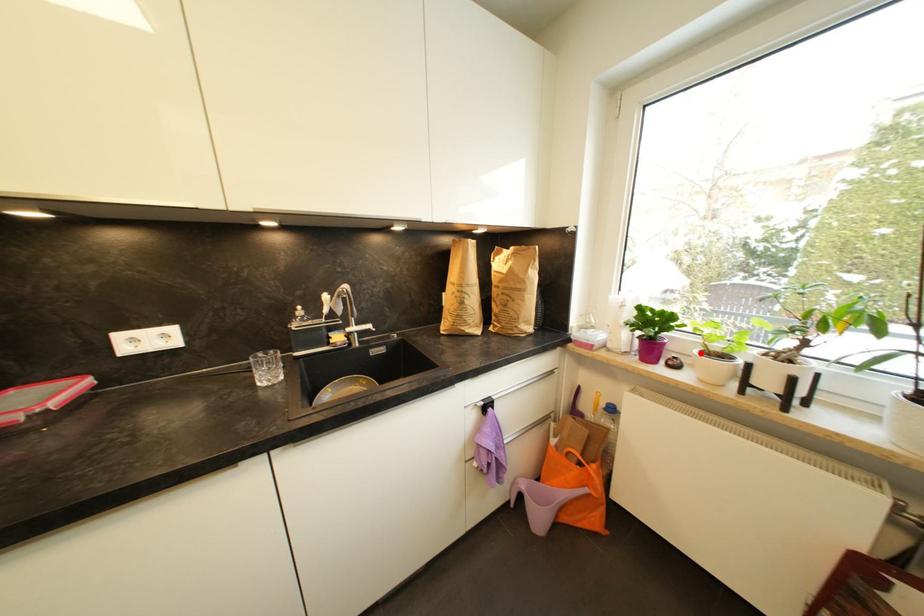
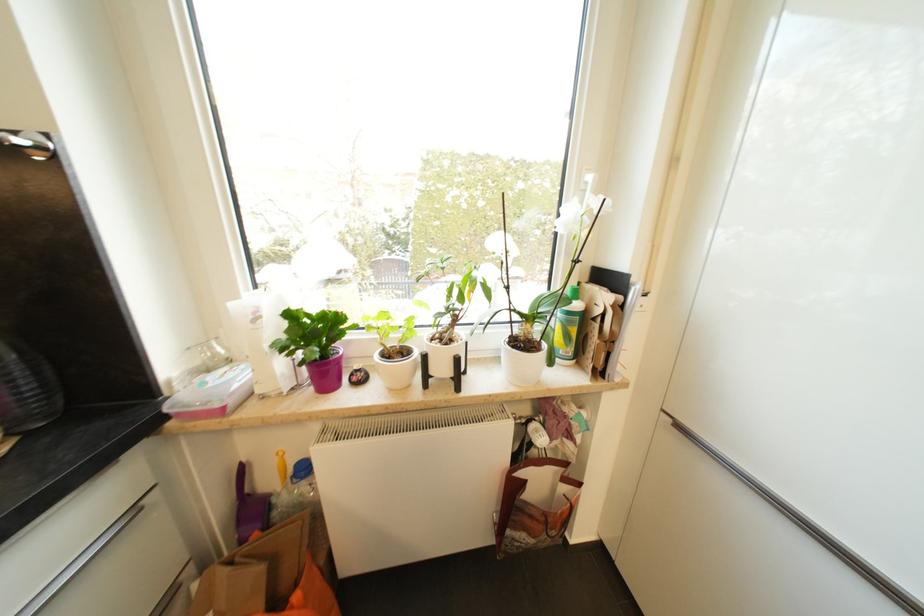
Where in the second image is the point corresponding to the highlighted location from the first image?

(381, 358)